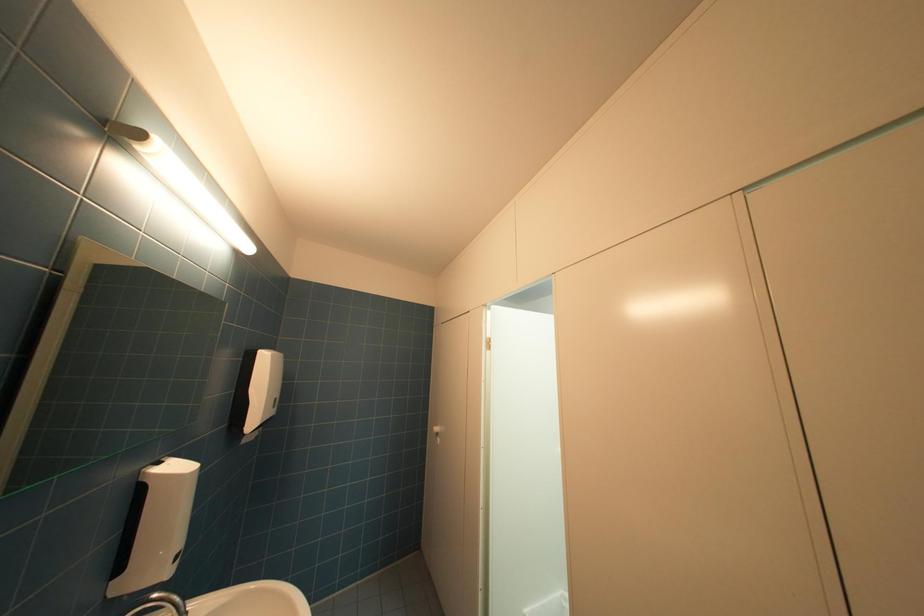
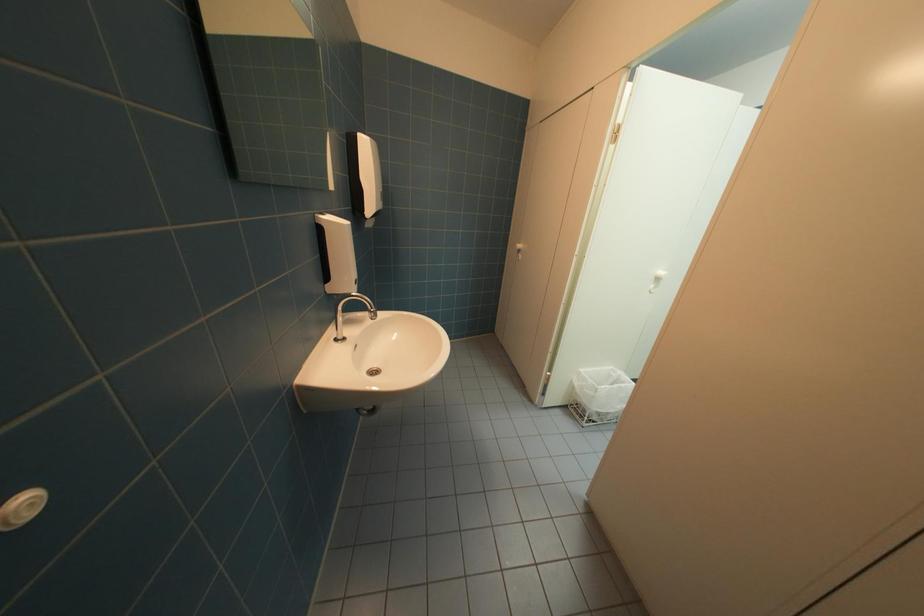
Question: The images are taken continuously from a first-person perspective. In which direction is your viewpoint rotating?

Choices:
 (A) Left
 (B) Right
 (C) Up
 (D) Down

Answer: (D)